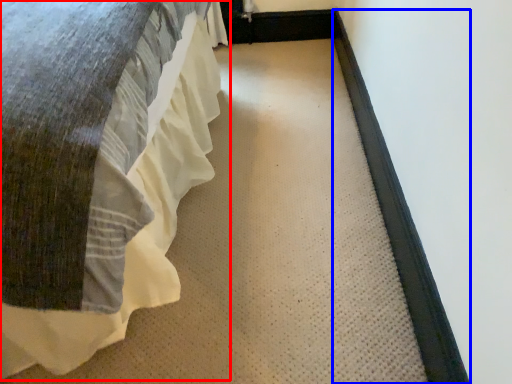
Question: Which point is further to the camera, bed (highlighted by a red box) or doormat (highlighted by a blue box)?

Choices:
 (A) bed
 (B) doormat

Answer: (B)